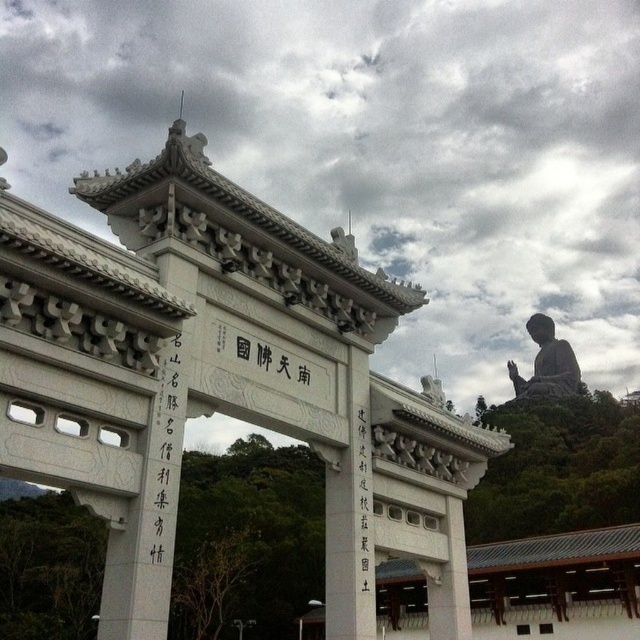
You are a tourist standing at the entrance of the temple complex and want to take a photo of both the white stone gate at center and the black stone statue at upper right in the same frame. Given that your camera has a maximum zoom range of 100 meters, will you be able to capture both objects in a single photo?

The distance between the white stone gate at center and the black stone statue at upper right is 142.38 meters, which exceeds the camera maximum zoom range of 100 meters. Therefore, you cannot capture both objects in a single photo.

You are an architect designing a new temple complex and want to place a decorative item between the white stone gate at center and the black stone statue at upper right. Based on their sizes, which object should you consider placing closer to the smaller one to maintain balance?

The black stone statue at upper right is smaller than the white stone gate at center, so placing the decorative item closer to the black stone statue at upper right would help maintain balance between the two objects.

You are standing in front of the traditional Chinese gate. There is a point marked at coordinates (221, 381). Which object does this point correspond to?

The point at coordinates (221, 381) corresponds to the white stone gate at center.